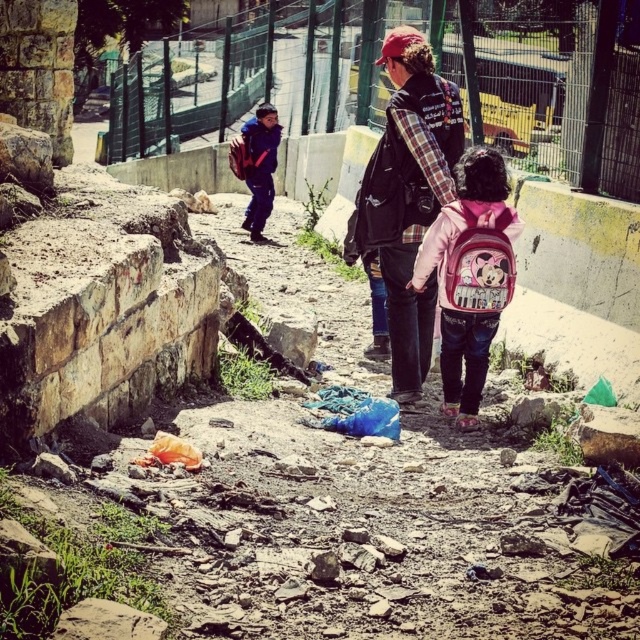
Question: From the image, what is the correct spatial relationship of plaid fabric shirt at center in relation to blue matte backpack at upper center?

Choices:
 (A) below
 (B) above

Answer: (A)

Question: Can you confirm if matte black backpack at center is positioned to the right of blue matte backpack at upper center?

Choices:
 (A) no
 (B) yes

Answer: (B)

Question: Which point is farther to the camera?

Choices:
 (A) (394, 237)
 (B) (486, 220)

Answer: (A)

Question: Which point is closer to the camera?

Choices:
 (A) (493, 305)
 (B) (358, 198)

Answer: (A)

Question: Is blue matte backpack at upper center to the left of matte purple backpack at upper left from the viewer's perspective?

Choices:
 (A) yes
 (B) no

Answer: (B)

Question: Which of the following is the farthest from the observer?

Choices:
 (A) (276, 115)
 (B) (372, 180)
 (C) (483, 317)
 (D) (241, 179)

Answer: (D)